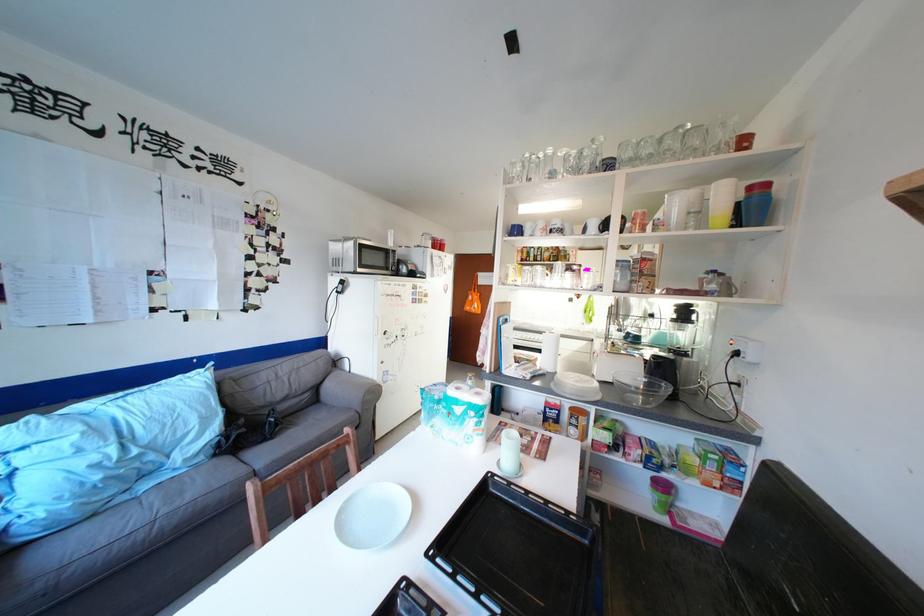
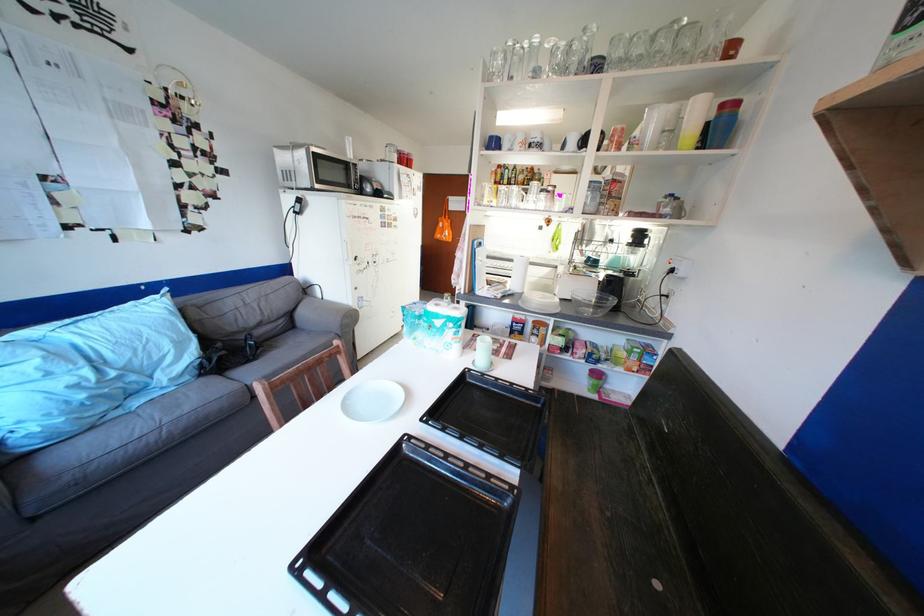
What movement of the cameraman would produce the second image?

The cameraman walked toward left, backward.